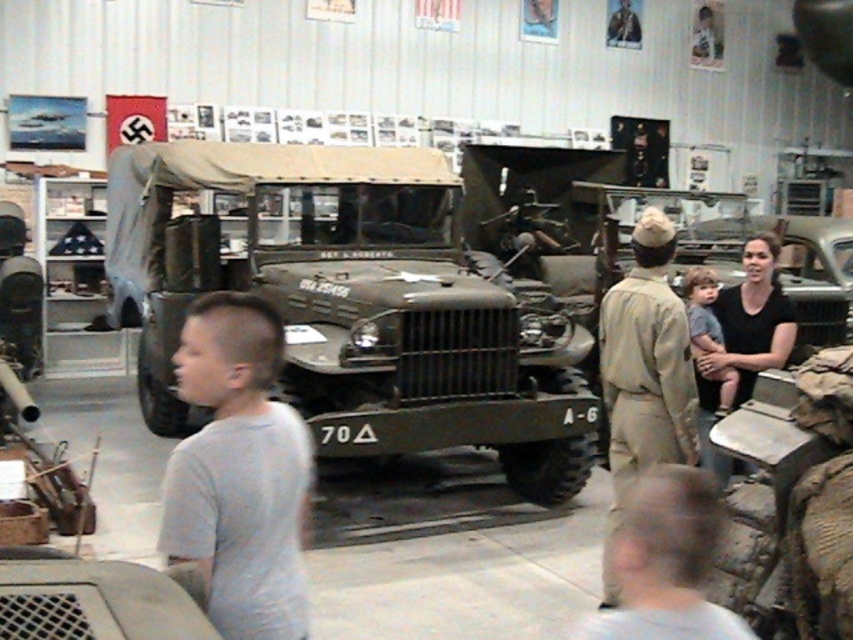
Who is shorter, tan uniform at center or black cotton shirt at right?

black cotton shirt at right

Between point (639, 412) and point (730, 349), which one is positioned in front?

Point (639, 412)

Where is `tan uniform at center`? The width and height of the screenshot is (853, 640). tan uniform at center is located at coordinates coord(643,371).

Who is positioned more to the right, light brown hair at center or black cotton shirt at right?

From the viewer's perspective, black cotton shirt at right appears more on the right side.

From the picture: Which of these two, light brown hair at center or black cotton shirt at right, stands shorter?

With less height is light brown hair at center.

Which is behind, point (636, 602) or point (759, 371)?

The point (759, 371) is behind.

I want to click on light brown hair at center, so click(x=665, y=561).

Is the position of matte green truck at center less distant than that of gray cotton shirt at center?

No, matte green truck at center is behind gray cotton shirt at center.

How far apart are matte green truck at center and gray cotton shirt at center?

matte green truck at center is 4.49 meters away from gray cotton shirt at center.

This screenshot has width=853, height=640. I want to click on matte green truck at center, so click(350, 304).